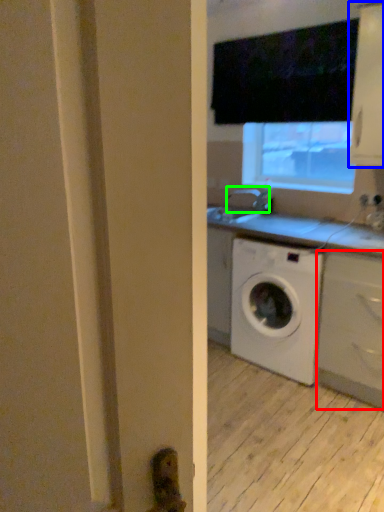
Question: Based on their relative distances, which object is farther from cabinetry (highlighted by a red box)? Choose from cabinetry (highlighted by a blue box) and faucet (highlighted by a green box).

Choices:
 (A) cabinetry
 (B) faucet

Answer: (B)